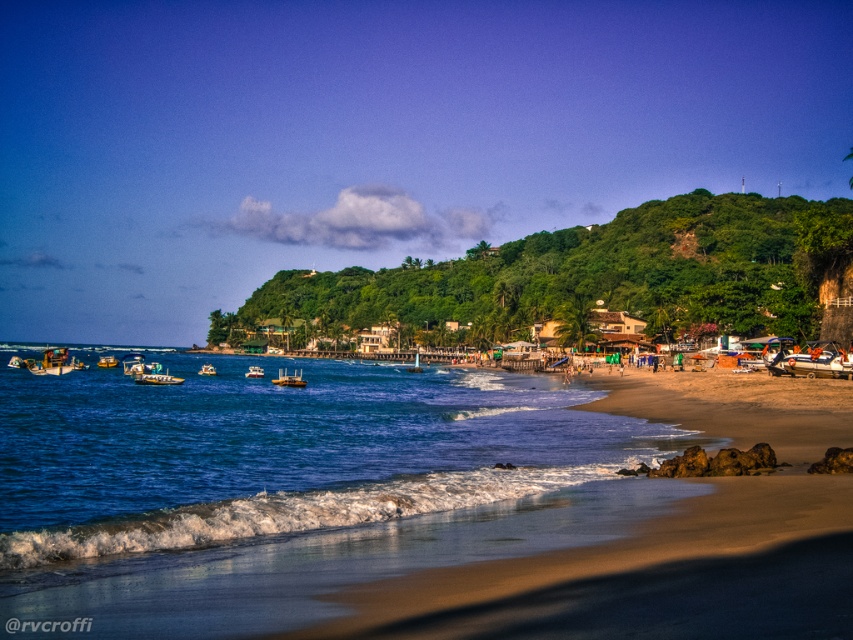
Does green leafy hillside at upper center have a greater height compared to translucent plastic boat at center-left?

Yes, green leafy hillside at upper center is taller than translucent plastic boat at center-left.

Is point (431, 332) closer to viewer compared to point (136, 360)?

No, it is not.

Locate an element on the screen. The image size is (853, 640). green leafy hillside at upper center is located at coordinates (590, 275).

Between point (115, 358) and point (212, 369), which one is positioned in front?

Positioned in front is point (212, 369).

Does yellow matte boat at center-left lie in front of yellow plastic boat at center?

No, yellow matte boat at center-left is further to the viewer.

Which is behind, point (102, 362) or point (202, 371)?

The point (102, 362) is more distant.

Find the location of a particular element. The width and height of the screenshot is (853, 640). yellow matte boat at center-left is located at coordinates (107, 362).

Does point (49, 360) come closer to viewer compared to point (283, 374)?

Yes, point (49, 360) is in front of point (283, 374).

Can you confirm if metallic silver boat at lower left is positioned to the left of metallic yellow boat at center?

Yes, metallic silver boat at lower left is to the left of metallic yellow boat at center.

Does point (70, 369) come closer to viewer compared to point (285, 369)?

Yes, it is.

This screenshot has height=640, width=853. Find the location of `metallic silver boat at lower left`. metallic silver boat at lower left is located at coordinates (51, 362).